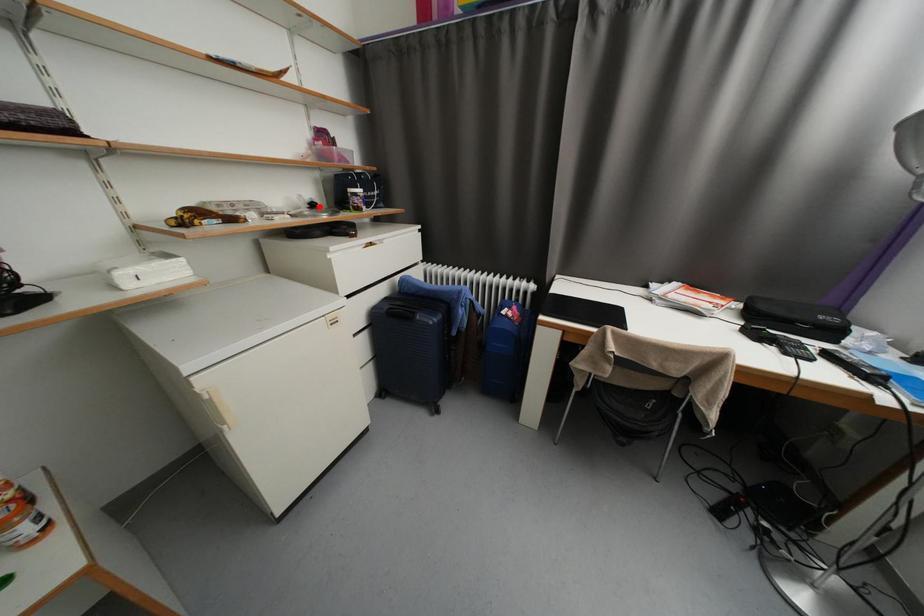
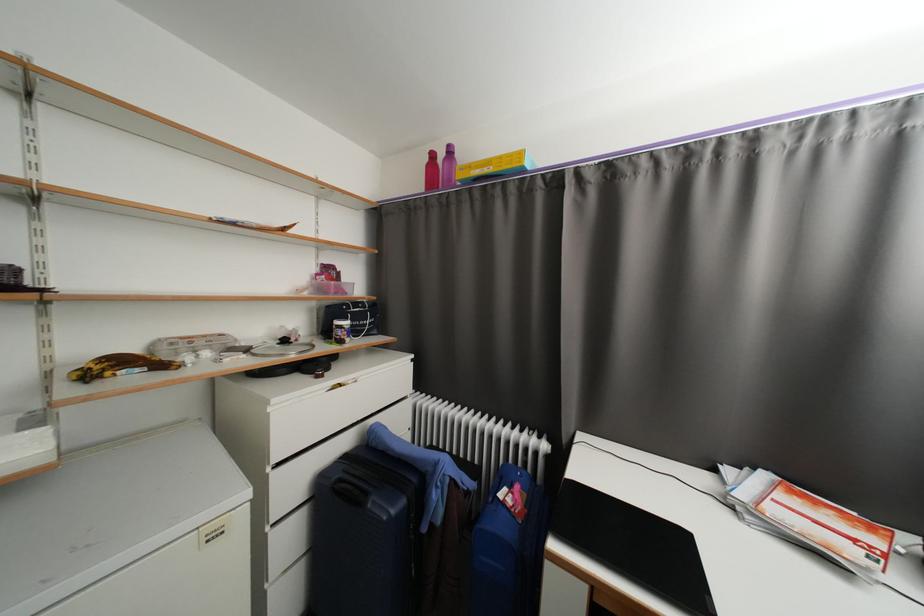
Question: I am providing you with two images of the same scene from different viewpoints. A red point is marked on the first image. At the location where the point appears in image 1, is it still visible in image 2?

Choices:
 (A) Yes
 (B) No

Answer: (A)